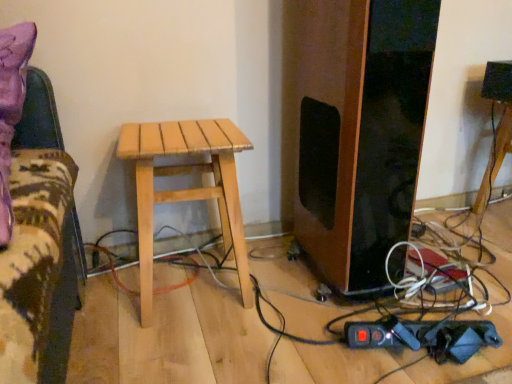
Locate an element on the screen. Image resolution: width=512 pixels, height=384 pixels. vacant location below natural wood stool at center (from a real-world perspective) is located at coordinates (189, 280).